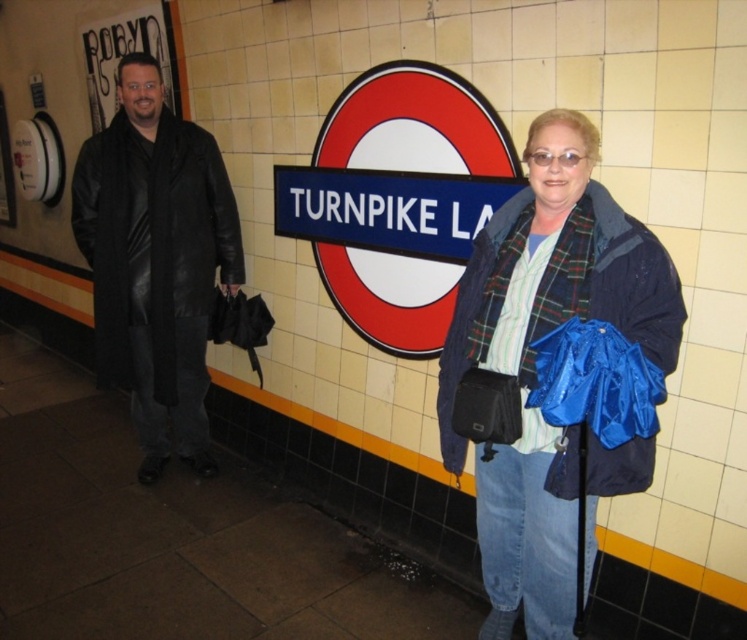
Can you confirm if blue plaid scarf at center is positioned to the right of black leather coat at left?

Indeed, blue plaid scarf at center is positioned on the right side of black leather coat at left.

Who is shorter, blue plaid scarf at center or black leather coat at left?

With less height is blue plaid scarf at center.

Is point (539, 132) closer to camera compared to point (164, 116)?

Yes.

This screenshot has width=747, height=640. What are the coordinates of `blue plaid scarf at center` in the screenshot? It's located at (557, 268).